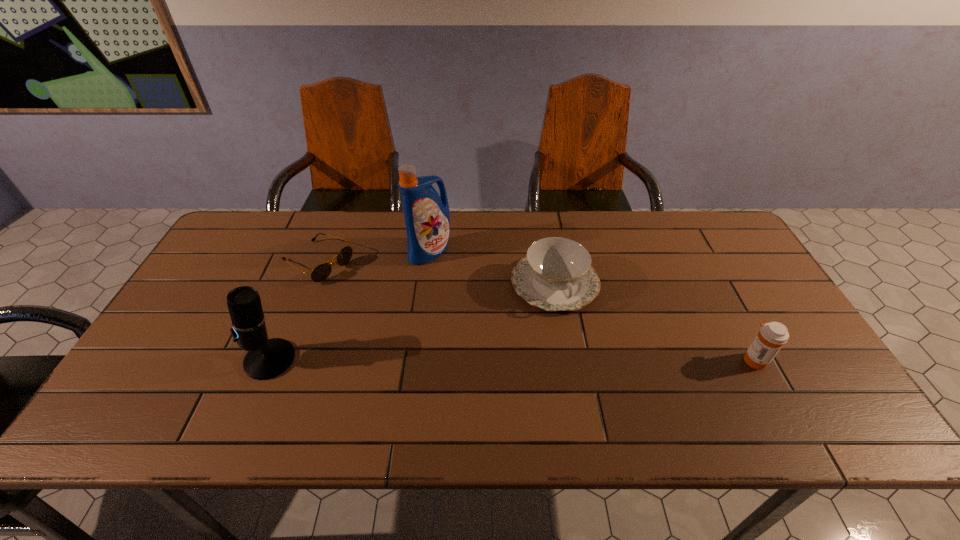
At what (x,y) coordinates should I click in order to perform the action: click on free space on the desktop that is between the fourth shortest object and the medicine and is positioned on the label of the third object from right to left. Please return your answer as a coordinate pair (x, y). This screenshot has height=540, width=960. Looking at the image, I should click on (519, 360).

You are a GUI agent. You are given a task and a screenshot of the screen. Output one action in this format:
    pyautogui.click(x=<x>, y=<y>)
    Task: Click on the free spot on the desktop that is between the microphone and the third tallest object and is positioned on the front-facing side of the shortest object
    This screenshot has height=540, width=960.
    Given the screenshot: What is the action you would take?
    pyautogui.click(x=485, y=360)

You are a GUI agent. You are given a task and a screenshot of the screen. Output one action in this format:
    pyautogui.click(x=<x>, y=<y>)
    Task: Click on the vacant space on the desktop that is between the second tallest object and the medicine and is positioned on the handle side of the second object from right to left
    The image size is (960, 540).
    Given the screenshot: What is the action you would take?
    pyautogui.click(x=585, y=360)